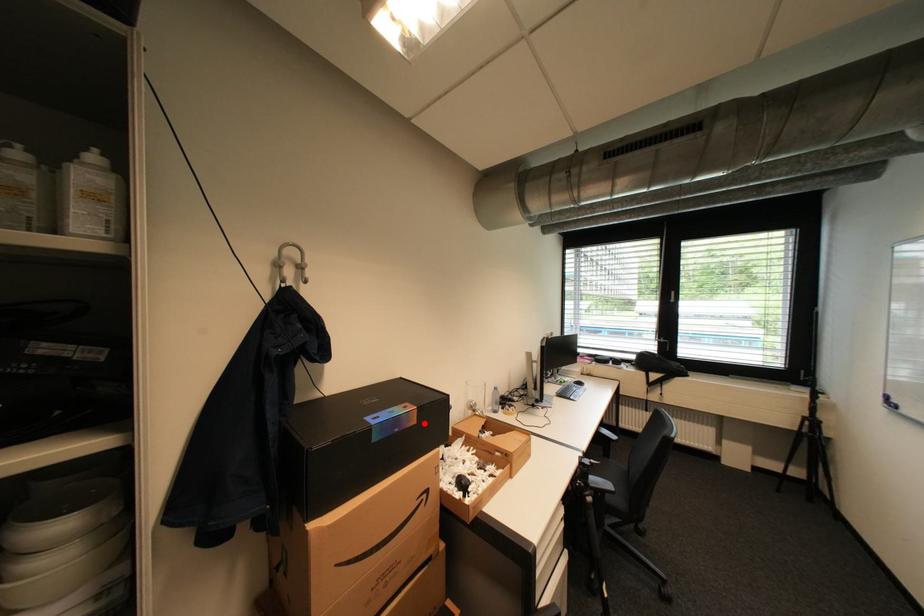
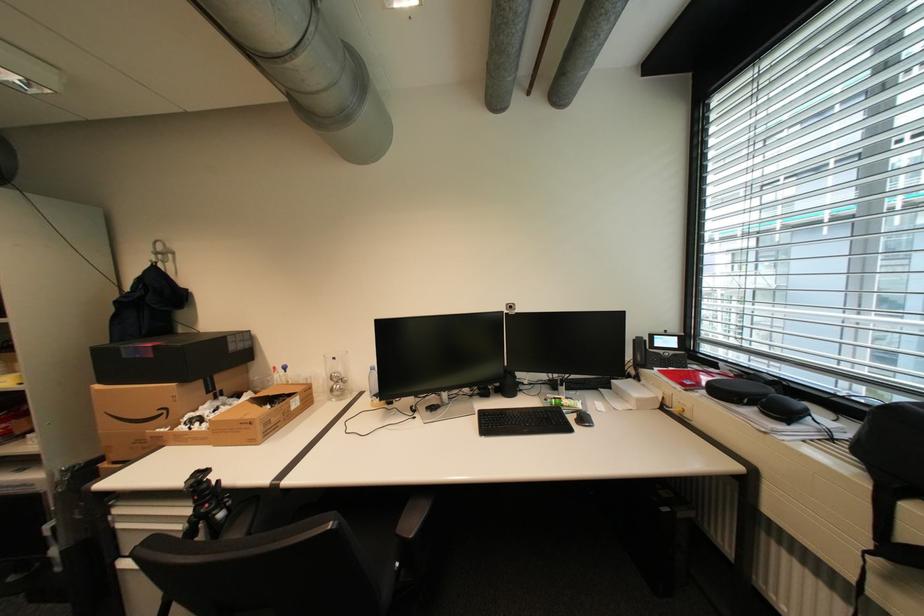
The point at the highlighted location is marked in the first image. Where is the corresponding point in the second image?

(161, 357)